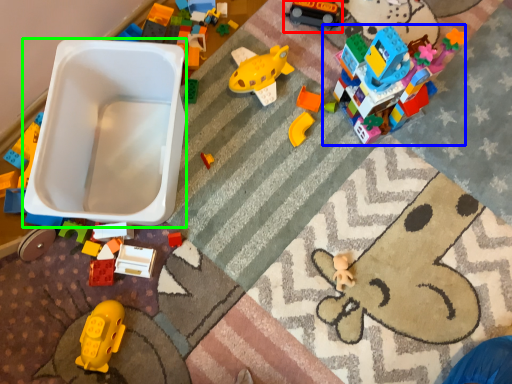
Question: Which object is positioned closest to toy (highlighted by a red box)? Select from toy (highlighted by a blue box) and toy car (highlighted by a green box).

Choices:
 (A) toy
 (B) toy car

Answer: (A)